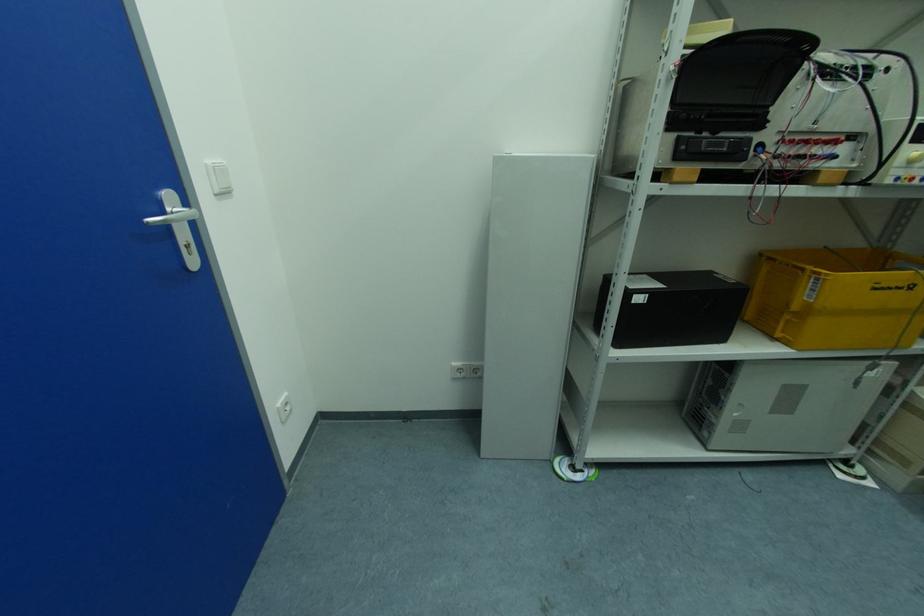
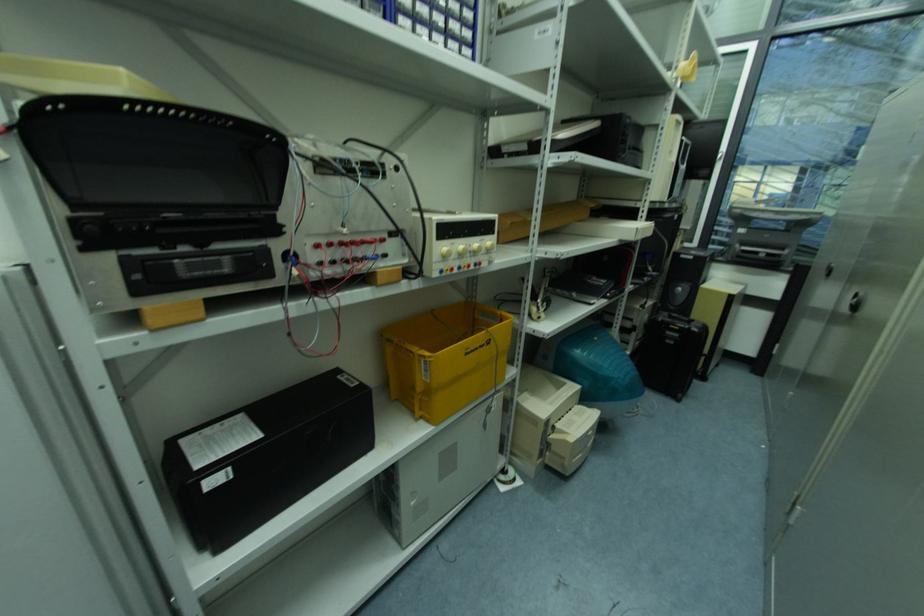
Question: The first image is from the beginning of the video and the second image is from the end. How did the camera likely rotate when shooting the video?

Choices:
 (A) Left
 (B) Right
 (C) Up
 (D) Down

Answer: (B)